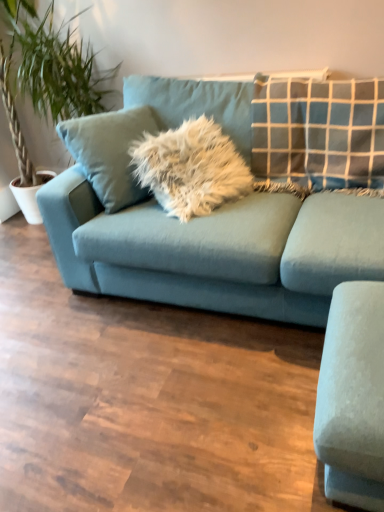
Question: Does matte blue couch at center have a greater height compared to green leafy plant at left?

Choices:
 (A) yes
 (B) no

Answer: (B)

Question: Is matte blue couch at center completely or partially outside of green leafy plant at left?

Choices:
 (A) yes
 (B) no

Answer: (A)

Question: Considering the relative sizes of matte blue couch at center and green leafy plant at left in the image provided, is matte blue couch at center wider than green leafy plant at left?

Choices:
 (A) yes
 (B) no

Answer: (A)

Question: From a real-world perspective, is matte blue couch at center physically above green leafy plant at left?

Choices:
 (A) yes
 (B) no

Answer: (B)

Question: From a real-world perspective, is matte blue couch at center located beneath green leafy plant at left?

Choices:
 (A) no
 (B) yes

Answer: (B)

Question: Is matte blue couch at center turned away from green leafy plant at left?

Choices:
 (A) no
 (B) yes

Answer: (A)

Question: From a real-world perspective, is white ceramic pot at left over green leafy plant at left?

Choices:
 (A) no
 (B) yes

Answer: (A)

Question: Is white ceramic pot at left in contact with green leafy plant at left?

Choices:
 (A) no
 (B) yes

Answer: (A)

Question: Considering the relative sizes of white ceramic pot at left and green leafy plant at left in the image provided, is white ceramic pot at left taller than green leafy plant at left?

Choices:
 (A) yes
 (B) no

Answer: (B)

Question: Is white ceramic pot at left completely or partially outside of green leafy plant at left?

Choices:
 (A) yes
 (B) no

Answer: (A)

Question: Does white ceramic pot at left lie behind green leafy plant at left?

Choices:
 (A) yes
 (B) no

Answer: (A)

Question: Is white ceramic pot at left in front of green leafy plant at left?

Choices:
 (A) yes
 (B) no

Answer: (B)

Question: From the image's perspective, is white ceramic pot at left under matte blue couch at center?

Choices:
 (A) no
 (B) yes

Answer: (A)